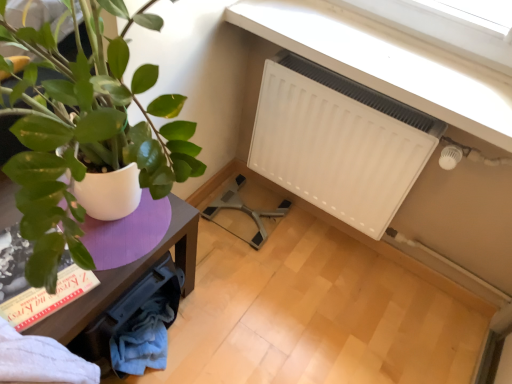
Where is `vacant space to the right of hardcover book at lower left`? vacant space to the right of hardcover book at lower left is located at coordinates (121, 260).